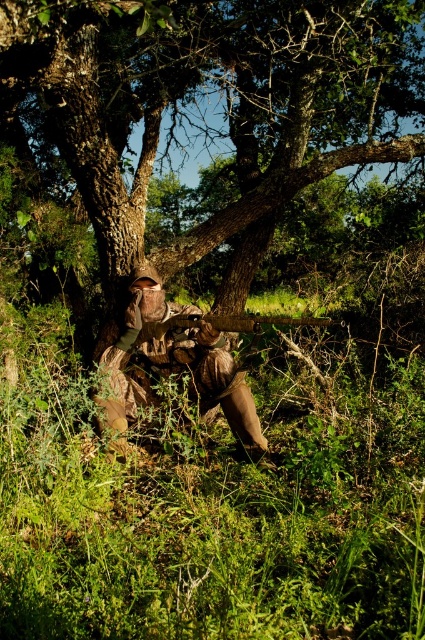
Does camouflage fabric rifle at center appear on the right side of wooden rifle at center?

In fact, camouflage fabric rifle at center is to the left of wooden rifle at center.

Does point (169, 333) come farther from viewer compared to point (218, 316)?

Yes, point (169, 333) is farther from viewer.

You are a GUI agent. You are given a task and a screenshot of the screen. Output one action in this format:
    pyautogui.click(x=<x>, y=<y>)
    Task: Click on the camouflage fabric rifle at center
    The width and height of the screenshot is (425, 640).
    Given the screenshot: What is the action you would take?
    pyautogui.click(x=172, y=364)

Who is shorter, brown/camouflage tree at center or camouflage fabric rifle at center?

camouflage fabric rifle at center is shorter.

Looking at this image, does brown/camouflage tree at center appear under camouflage fabric rifle at center?

Incorrect, brown/camouflage tree at center is not positioned below camouflage fabric rifle at center.

Where is `brown/camouflage tree at center`? brown/camouflage tree at center is located at coordinates (229, 134).

Is brown/camouflage tree at center to the left of wooden rifle at center from the viewer's perspective?

In fact, brown/camouflage tree at center is to the right of wooden rifle at center.

Can you confirm if brown/camouflage tree at center is bigger than wooden rifle at center?

Yes, brown/camouflage tree at center is bigger than wooden rifle at center.

At what (x,y) coordinates should I click in order to perform the action: click on brown/camouflage tree at center. Please return your answer as a coordinate pair (x, y). Looking at the image, I should click on (229, 134).

Identify the location of brown/camouflage tree at center. This screenshot has width=425, height=640. (229, 134).